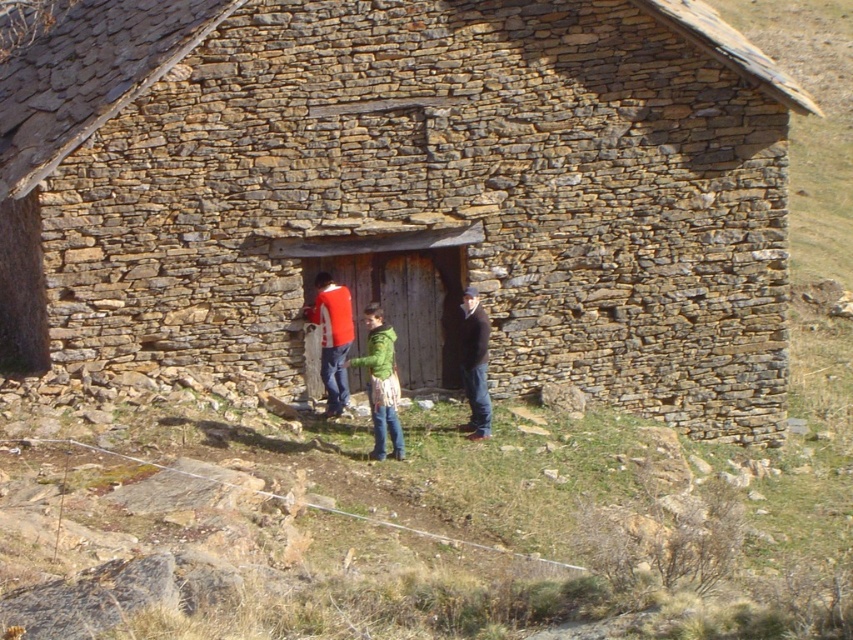
Question: Which object is positioned closest to the green wool sweater at center?

Choices:
 (A) green matte jacket at center
 (B) rustic stone hut at center
 (C) dark brown leather jacket at center

Answer: (A)

Question: Is red cotton sweater at center bigger than dark brown leather jacket at center?

Choices:
 (A) yes
 (B) no

Answer: (A)

Question: Which of the following is the farthest from the observer?

Choices:
 (A) (381, 323)
 (B) (85, 349)
 (C) (332, 300)

Answer: (B)

Question: Among these objects, which one is nearest to the camera?

Choices:
 (A) green wool sweater at center
 (B) green matte jacket at center
 (C) red cotton sweater at center
 (D) dark brown leather jacket at center

Answer: (B)

Question: Is green matte jacket at center wider than dark brown leather jacket at center?

Choices:
 (A) yes
 (B) no

Answer: (A)

Question: Can you confirm if rustic stone hut at center is wider than green matte jacket at center?

Choices:
 (A) yes
 (B) no

Answer: (A)